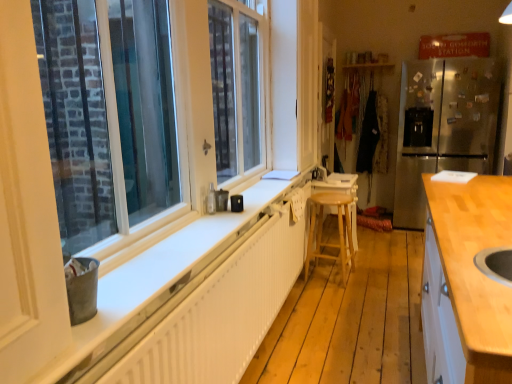
Question: Relative to light brown wooden stool at center, is stainless steel refrigerator at right in front or behind?

Choices:
 (A) front
 (B) behind

Answer: (B)

Question: In terms of height, does stainless steel refrigerator at right look taller or shorter compared to light brown wooden stool at center?

Choices:
 (A) tall
 (B) short

Answer: (A)

Question: Which object is the farthest from the stainless steel refrigerator at right?

Choices:
 (A) light wood countertop at right
 (B) brushed metal faucet at center
 (C) white plastic window at left
 (D) light brown wooden stool at center
 (E) wooden stool at center

Answer: (C)

Question: Considering the real-world distances, which object is farthest from the white textured radiator at lower center?

Choices:
 (A) white plastic window at left
 (B) light wood countertop at right
 (C) wooden stool at center
 (D) light brown wooden stool at center
 (E) stainless steel refrigerator at right

Answer: (E)